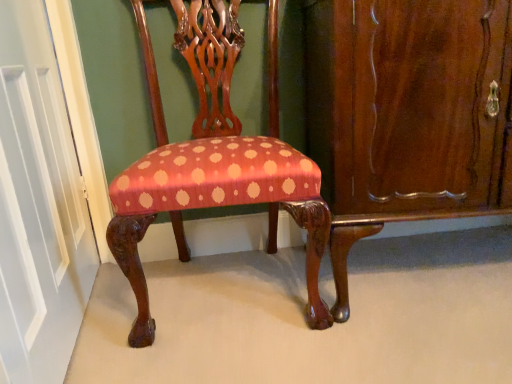
I want to click on free space on the front side of silky red fabric chair at center, so click(245, 360).